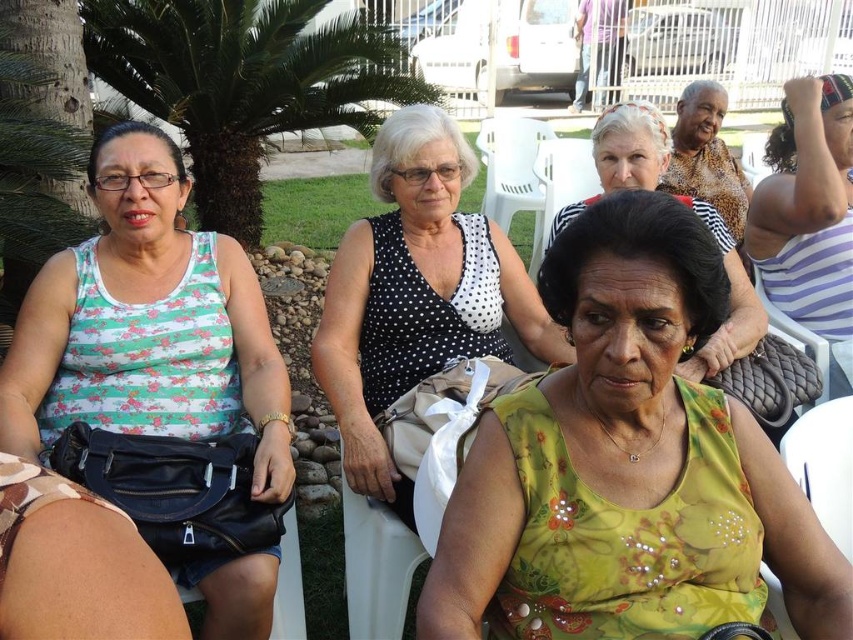
You are a photographer planning to take a group photo of the women in the scene. The matte green and white striped tank top at left and the black leather chair at right are in your frame. Considering their sizes, which object would you need to adjust your camera angle to focus on first if you want to include both in the shot?

The matte green and white striped tank top at left is larger in size compared to the black leather chair at right. To include both in the shot, you might need to focus on the larger object first, which is the matte green and white striped tank top at left, and then adjust the angle to ensure the black leather chair at right is also visible.

You are planning to take a photo of the green sequined blouse at center and the striped fabric shirt at upper right. If you want both to be in focus, what should you consider about their distance?

The green sequined blouse at center and the striped fabric shirt at upper right are 5.00 feet apart. To ensure both are in focus, you need to adjust the camera focus so that the depth of field can cover the 5.00 feet distance between them.

You are designing a new clothing line and want to ensure that the matte green and white striped tank top at left will fit comfortably on a mannequin that is the same size as the black leather chair at right. Based on the image, will the tank top at left fit on the mannequin?

The matte green and white striped tank top at left is larger in width than the black leather chair at right, so it should fit comfortably on a mannequin of the same size as the chair.